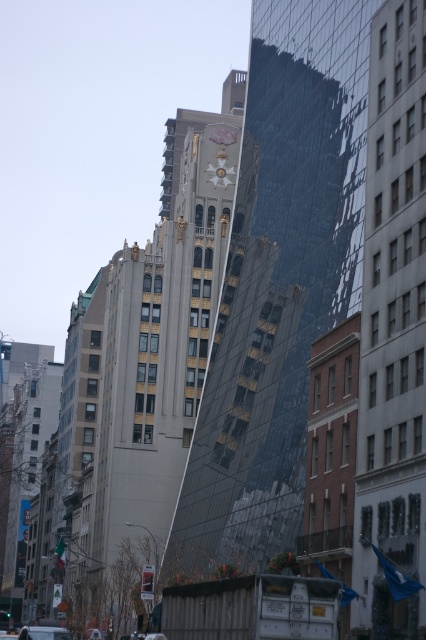
Question: Can you confirm if gold/golden metallic building at center is thinner than gold metallic clock at upper center?

Choices:
 (A) yes
 (B) no

Answer: (B)

Question: Which is nearer to the white matte car at lower left?

Choices:
 (A) gold metallic clock at upper center
 (B) gold ornate tower at center
 (C) reflective glass skyscraper at center

Answer: (C)

Question: Among these points, which one is farthest from the camera?

Choices:
 (A) (380, 132)
 (B) (342, 300)

Answer: (B)

Question: Is reflective glass skyscraper at center in front of white matte car at lower left?

Choices:
 (A) yes
 (B) no

Answer: (A)

Question: Can you confirm if reflective glass skyscraper at center is wider than white matte car at lower left?

Choices:
 (A) yes
 (B) no

Answer: (B)

Question: Which object is closer to the camera taking this photo?

Choices:
 (A) gold metallic clock at upper center
 (B) reflective glass skyscraper at center
 (C) white matte car at lower left
 (D) gold/golden metallic building at center

Answer: (B)